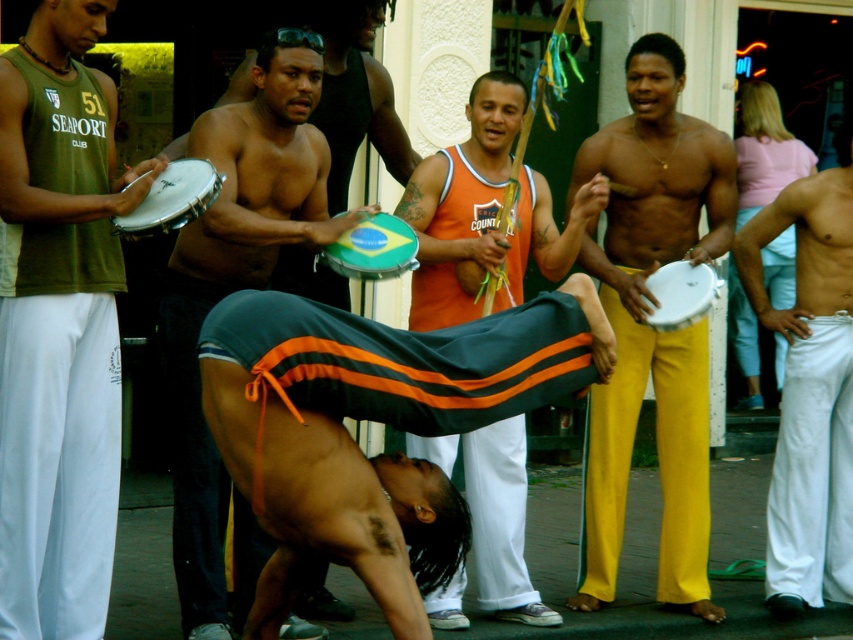
Question: Does matte green tank top at left appear on the right side of orange jersey at center?

Choices:
 (A) yes
 (B) no

Answer: (B)

Question: Which object is the farthest from the matte green tank top at left?

Choices:
 (A) black fabric pants at center
 (B) yellow cotton pants at center

Answer: (B)

Question: Which point is farther to the camera?

Choices:
 (A) (207, 268)
 (B) (405, 433)
 (C) (64, 321)
 (D) (593, 308)

Answer: (B)

Question: Which object is positioned closest to the matte green tank top at left?

Choices:
 (A) orange jersey at center
 (B) white cotton pants at right
 (C) yellow cotton pants at center

Answer: (A)

Question: Is matte green tank top at left in front of orange jersey at center?

Choices:
 (A) yes
 (B) no

Answer: (A)

Question: Does matte green tank top at left appear on the left side of yellow cotton pants at center?

Choices:
 (A) yes
 (B) no

Answer: (A)